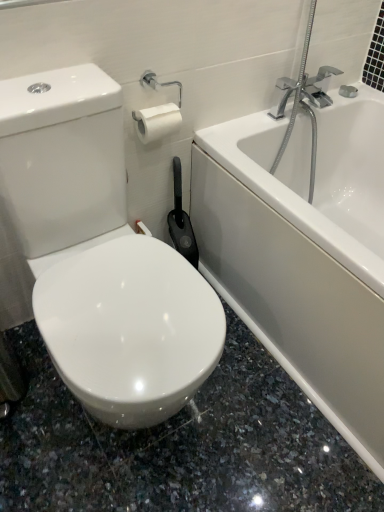
The height and width of the screenshot is (512, 384). What do you see at coordinates (304, 251) in the screenshot? I see `white glossy bathtub at upper right` at bounding box center [304, 251].

The image size is (384, 512). Find the location of `white glossy bathtub at upper right`. white glossy bathtub at upper right is located at coordinates (304, 251).

At what (x,y) coordinates should I click in order to perform the action: click on white glossy toilet at center. Please return your answer as a coordinate pair (x, y). This screenshot has width=384, height=512. Looking at the image, I should click on (100, 254).

What do you see at coordinates (100, 254) in the screenshot? Image resolution: width=384 pixels, height=512 pixels. I see `white glossy toilet at center` at bounding box center [100, 254].

Locate an element on the screen. white glossy bathtub at upper right is located at coordinates (304, 251).

Which object is positioned more to the right, white glossy bathtub at upper right or white glossy toilet at center?

Positioned to the right is white glossy bathtub at upper right.

Considering the positions of objects white glossy bathtub at upper right and white glossy toilet at center in the image provided, who is behind, white glossy bathtub at upper right or white glossy toilet at center?

white glossy bathtub at upper right.

Which is closer to the camera, (380, 125) or (121, 159)?

The point (121, 159) is closer to the camera.

From the image's perspective, is white glossy bathtub at upper right below white glossy toilet at center?

Actually, white glossy bathtub at upper right appears above white glossy toilet at center in the image.

From a real-world perspective, between white glossy bathtub at upper right and white glossy toilet at center, who is vertically lower?

white glossy bathtub at upper right is physically lower.

From the picture: Between white glossy bathtub at upper right and white glossy toilet at center, which one has larger width?

white glossy bathtub at upper right.

In the scene shown: Is white glossy bathtub at upper right taller than white glossy toilet at center?

No.

Can you confirm if white glossy bathtub at upper right is bigger than white glossy toilet at center?

Yes, white glossy bathtub at upper right is bigger than white glossy toilet at center.

Would you say white glossy bathtub at upper right is inside or outside white glossy toilet at center?

white glossy bathtub at upper right is not enclosed by white glossy toilet at center.

Looking at this image, are white glossy bathtub at upper right and white glossy toilet at center far apart?

No, there isn't a large distance between white glossy bathtub at upper right and white glossy toilet at center.

Could you tell me if white glossy bathtub at upper right is facing white glossy toilet at center?

Yes, white glossy bathtub at upper right is oriented towards white glossy toilet at center.

Image resolution: width=384 pixels, height=512 pixels. What are the coordinates of `toilet above the white glossy bathtub at upper right (from a real-world perspective)` in the screenshot? It's located at (100, 254).

In the image, is white glossy toilet at center on the left side or the right side of white glossy bathtub at upper right?

white glossy toilet at center is positioned on white glossy bathtub at upper right's left side.

Considering the positions of objects white glossy toilet at center and white glossy bathtub at upper right in the image provided, who is behind, white glossy toilet at center or white glossy bathtub at upper right?

Positioned behind is white glossy bathtub at upper right.

Which is behind, point (100, 315) or point (311, 312)?

The point (311, 312) is farther from the camera.

From the image's perspective, is white glossy toilet at center over white glossy bathtub at upper right?

No, from the image's perspective, white glossy toilet at center is not on top of white glossy bathtub at upper right.

From the picture: From a real-world perspective, which is physically below, white glossy toilet at center or white glossy bathtub at upper right?

white glossy bathtub at upper right.

Consider the image. Between white glossy toilet at center and white glossy bathtub at upper right, which one has larger width?

white glossy bathtub at upper right is wider.

Which of these two, white glossy toilet at center or white glossy bathtub at upper right, stands shorter?

With less height is white glossy bathtub at upper right.

Who is bigger, white glossy toilet at center or white glossy bathtub at upper right?

white glossy bathtub at upper right is bigger.

Is white glossy toilet at center not inside white glossy bathtub at upper right?

white glossy toilet at center lies outside white glossy bathtub at upper right's area.

Based on the photo, is white glossy toilet at center with white glossy bathtub at upper right?

No, white glossy toilet at center is not touching white glossy bathtub at upper right.

Is white glossy toilet at center turned away from white glossy bathtub at upper right?

white glossy toilet at center does not have its back to white glossy bathtub at upper right.

At what (x,y) coordinates should I click in order to perform the action: click on bathtub that is behind the white glossy toilet at center. Please return your answer as a coordinate pair (x, y). Looking at the image, I should click on (304, 251).

In the image, there is a white glossy toilet at center. Where is `bathtub above it (from the image's perspective)`? The width and height of the screenshot is (384, 512). bathtub above it (from the image's perspective) is located at coordinates (304, 251).

Find the location of a particular element. The height and width of the screenshot is (512, 384). toilet to the left of white glossy bathtub at upper right is located at coordinates (100, 254).